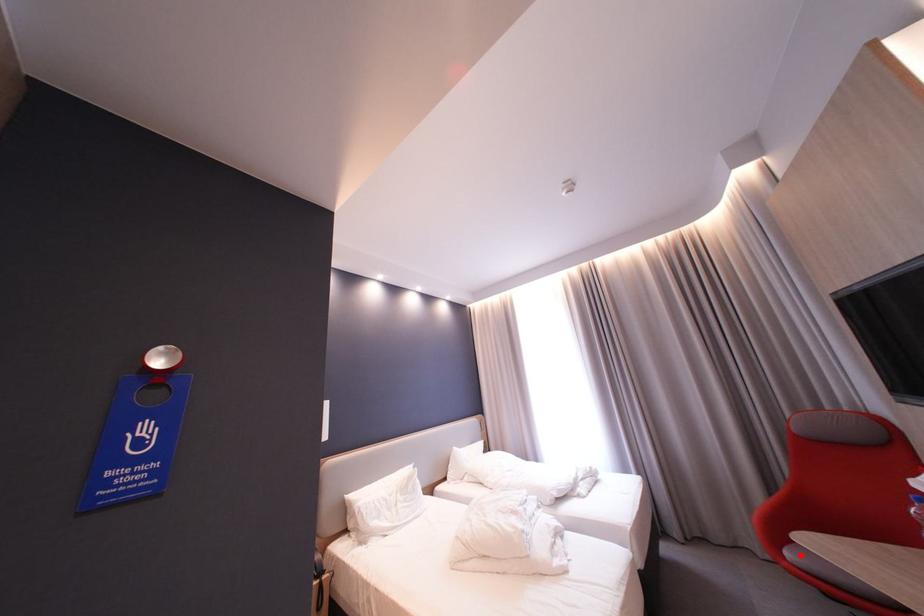
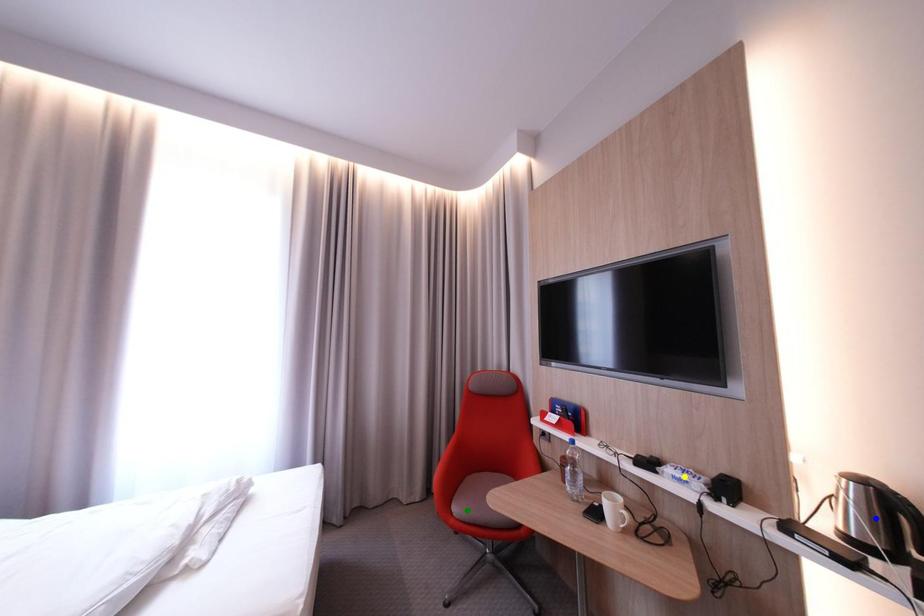
Question: I am providing you with two images of the same scene from different viewpoints. A red point is marked on the first image. You are given multiple points on the second image. Which spot in image 2 lines up with the point in image 1?

Choices:
 (A) yellow point
 (B) blue point
 (C) green point

Answer: (C)